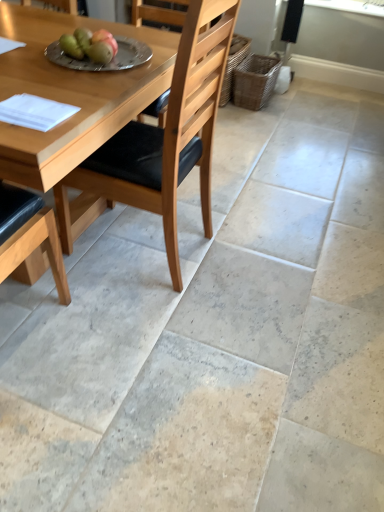
What are the coordinates of `free space in front of silver metallic plate at upper center` in the screenshot? It's located at (71, 79).